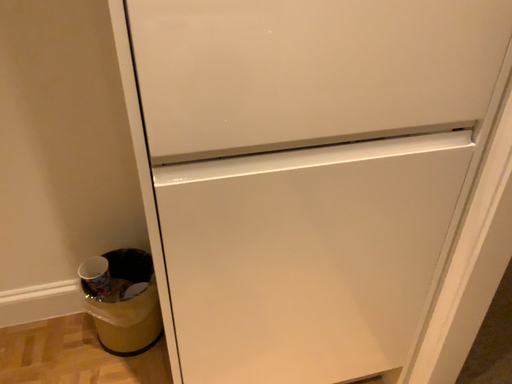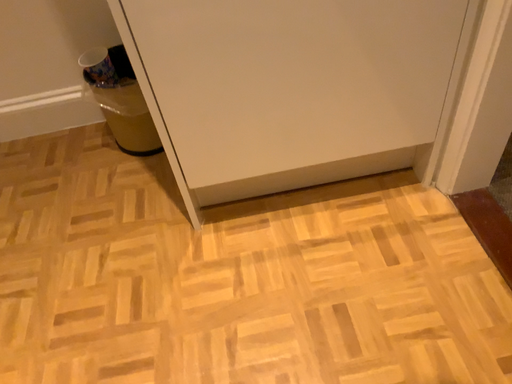
Question: Which way did the camera rotate in the video?

Choices:
 (A) rotated right
 (B) rotated left

Answer: (B)